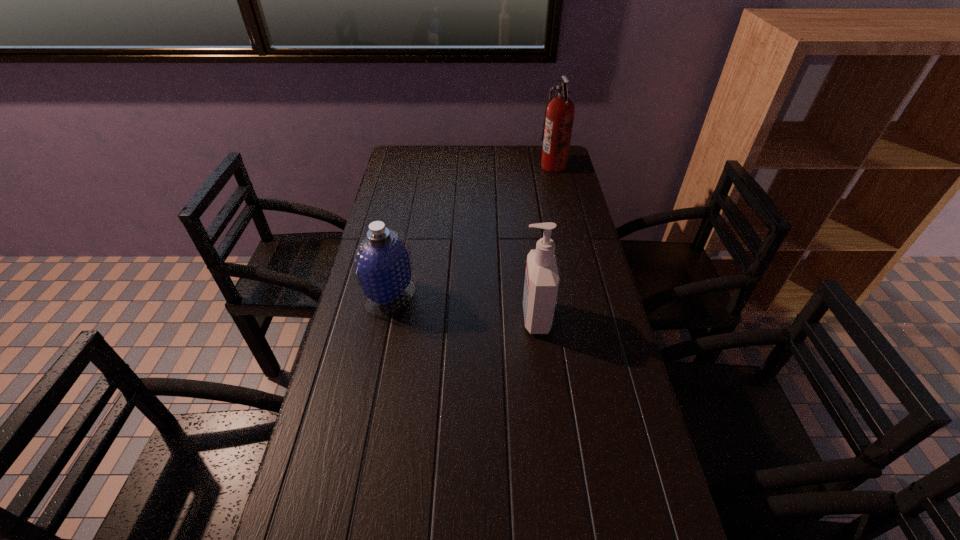
Where is `free space at the far right corner of the desktop`? The image size is (960, 540). free space at the far right corner of the desktop is located at coordinates (530, 163).

Find the location of a particular element. This screenshot has width=960, height=540. vacant region between the fire extinguisher and the left cleansing agent is located at coordinates (472, 231).

Identify the location of object that can be found as the second closest to the left cleansing agent. The image size is (960, 540). (559, 115).

Locate which object ranks second in proximity to the taller cleansing agent. Please provide its 2D coordinates. Your answer should be formatted as a tuple, i.e. [(x, y)], where the tuple contains the x and y coordinates of a point satisfying the conditions above.

[(559, 115)]